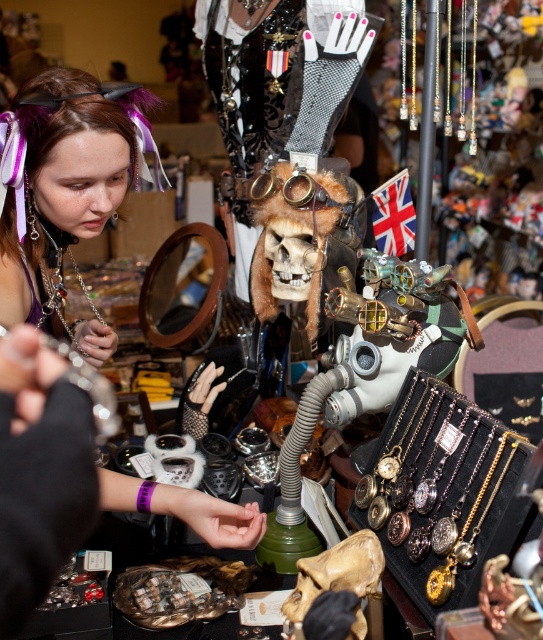
Question: Can you confirm if gold plated watch at center is thinner than brown matte skull at center?

Choices:
 (A) yes
 (B) no

Answer: (B)

Question: Is matte purple hair clip at upper left to the left of smooth matte skull at center from the viewer's perspective?

Choices:
 (A) yes
 (B) no

Answer: (A)

Question: Estimate the real-world distances between objects in this image. Which object is farther from the smooth matte skull at center?

Choices:
 (A) gold metallic goggles at center
 (B) shiny metallic skull at center

Answer: (A)

Question: Is matte purple hair clip at upper left below shiny metallic skull at center?

Choices:
 (A) yes
 (B) no

Answer: (A)

Question: Which object appears farthest from the camera in this image?

Choices:
 (A) smooth matte skull at center
 (B) matte purple hair clip at upper left
 (C) shiny metallic skull at center

Answer: (A)

Question: Which object is farther from the camera taking this photo?

Choices:
 (A) gold metallic goggles at center
 (B) matte purple hair clip at upper left
 (C) gold plated watch at center
 (D) brown matte skull at center

Answer: (A)